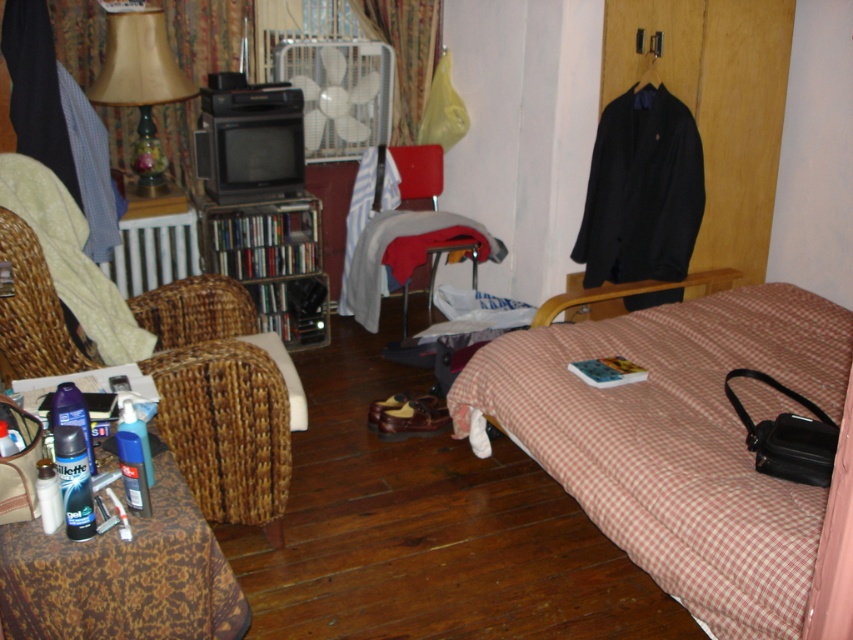
You are a delivery person trying to place a package between the matte fabric lamp at upper left and the gray fabric chair at center. The package is 18 inches long. Can you fit it in the space between them?

The distance between the matte fabric lamp at upper left and the gray fabric chair at center is 38.30 inches. Since the package is 18 inches long, it can easily fit in the space between them as there is sufficient room.